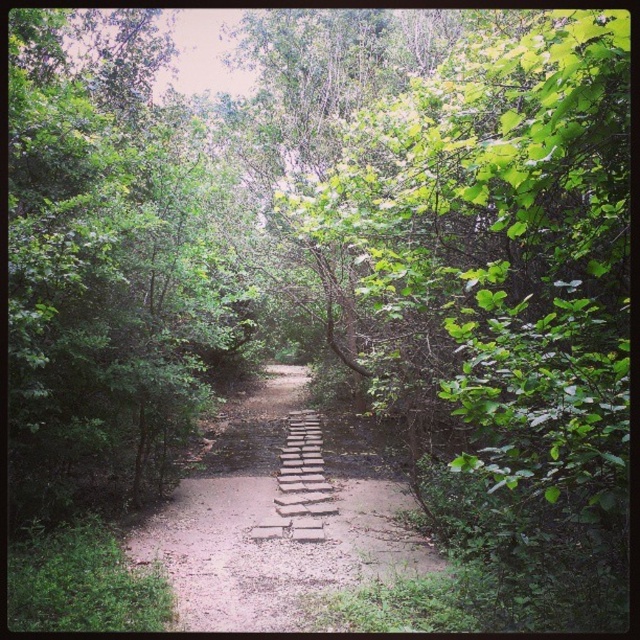
Question: Which of the following is the farthest from the observer?

Choices:
 (A) (262, 604)
 (B) (291, 467)

Answer: (B)

Question: Among these points, which one is farthest from the camera?

Choices:
 (A) (253, 566)
 (B) (312, 490)

Answer: (B)

Question: Does brick-like stone steps at center lie behind brown stone stairs at center?

Choices:
 (A) yes
 (B) no

Answer: (B)

Question: Considering the relative positions of brick-like stone steps at center and brown stone stairs at center in the image provided, where is brick-like stone steps at center located with respect to brown stone stairs at center?

Choices:
 (A) below
 (B) above

Answer: (A)

Question: Does brick-like stone steps at center appear over brown stone stairs at center?

Choices:
 (A) yes
 (B) no

Answer: (B)